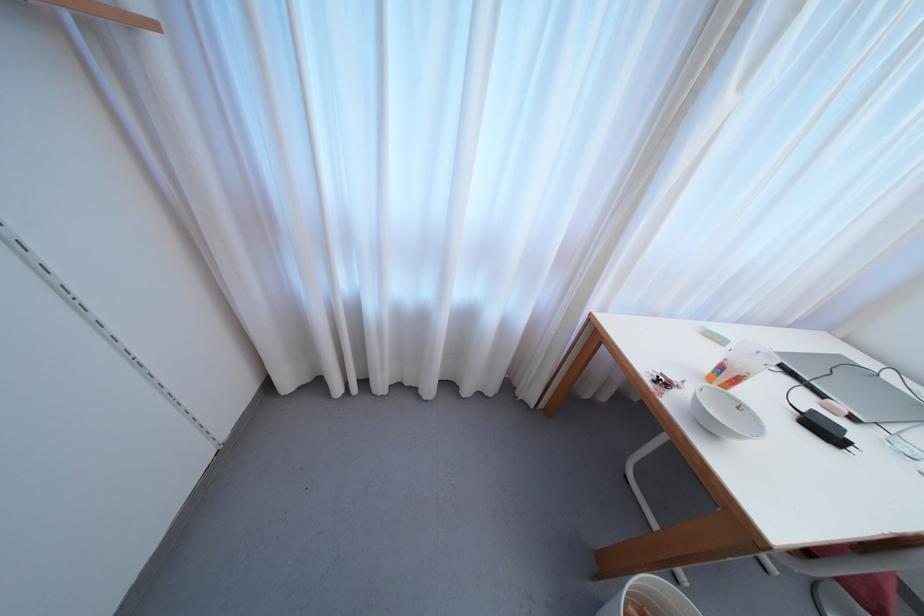
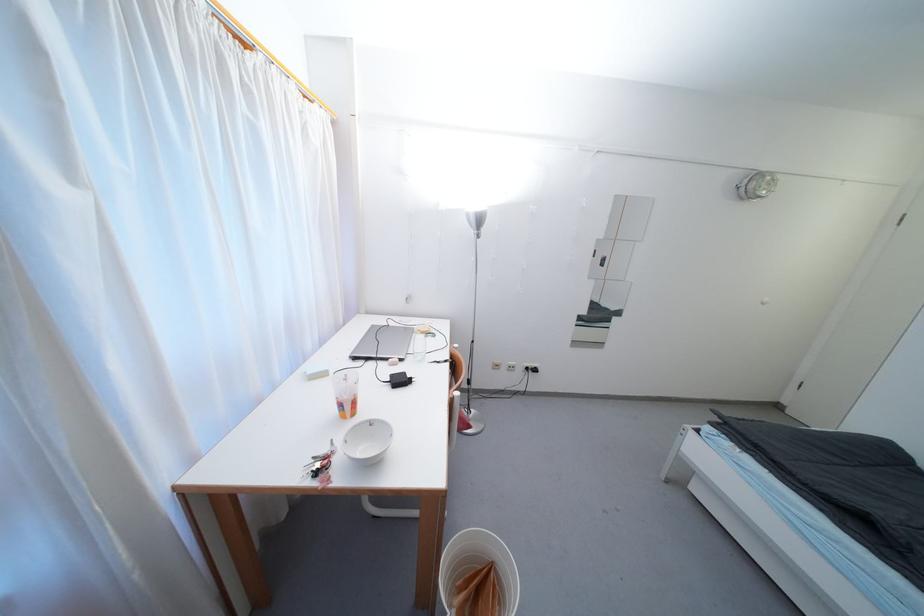
Locate, in the second image, the point that corresponds to [894,381] in the first image.

(395, 326)